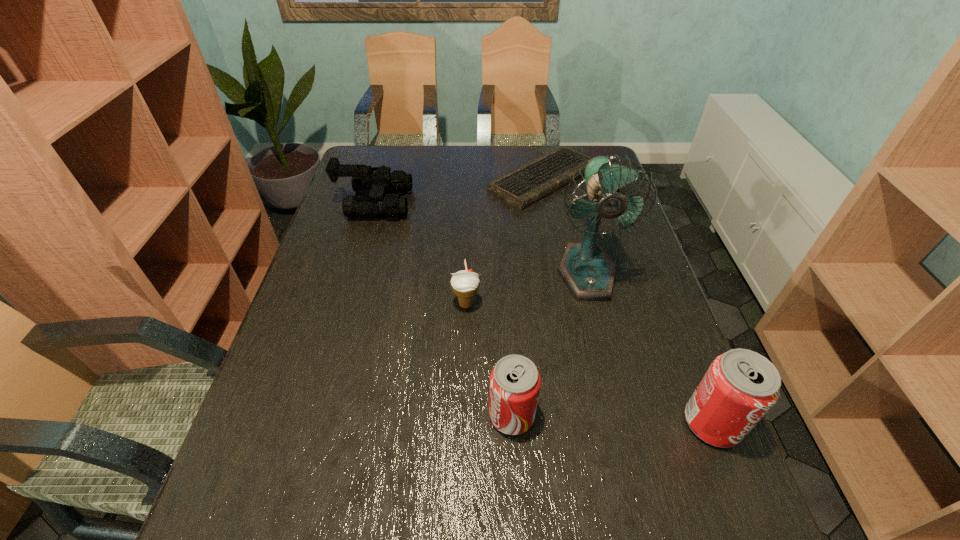
Where is `the shorter soda can`? The height and width of the screenshot is (540, 960). the shorter soda can is located at coordinates (514, 384).

Where is `the right soda can`? The height and width of the screenshot is (540, 960). the right soda can is located at coordinates (740, 386).

Identify the location of the rightmost object. (740, 386).

Where is `the shortest object`? The image size is (960, 540). the shortest object is located at coordinates (522, 187).

You are a GUI agent. You are given a task and a screenshot of the screen. Output one action in this format:
    pyautogui.click(x=<x>, y=<y>)
    Task: Click on the binoculars
    This screenshot has width=960, height=540.
    Given the screenshot: What is the action you would take?
    pyautogui.click(x=364, y=180)

I want to click on the tallest object, so click(589, 273).

The image size is (960, 540). Find the location of `the fifth object from right to left`. the fifth object from right to left is located at coordinates [465, 284].

This screenshot has width=960, height=540. Find the location of `free space located on the right of the left soda can`. free space located on the right of the left soda can is located at coordinates (647, 415).

Where is `blank space located on the back of the second tallest object`? The image size is (960, 540). blank space located on the back of the second tallest object is located at coordinates (660, 291).

Where is `vacant area located 0.300m on the left of the shortest object`? The width and height of the screenshot is (960, 540). vacant area located 0.300m on the left of the shortest object is located at coordinates (400, 179).